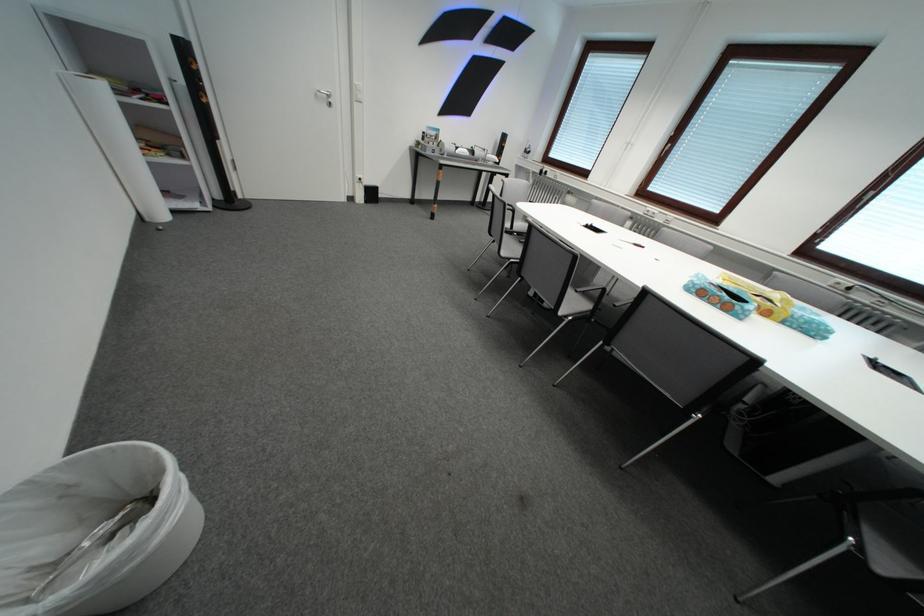
Find the location of a particular element. The width and height of the screenshot is (924, 616). white paper roll is located at coordinates (94, 531).